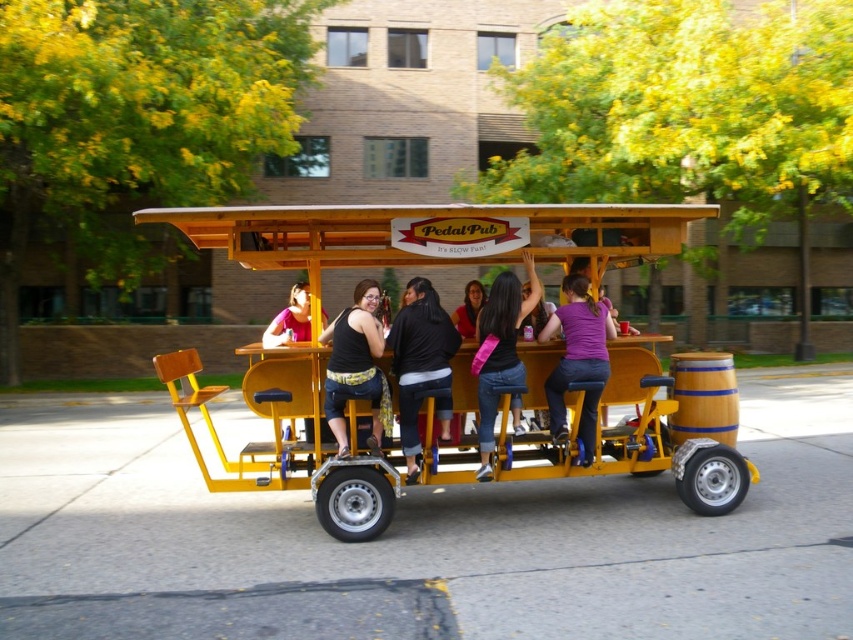
Which is above, yellow wood pedal pub at center or matte black shirt at center?

matte black shirt at center is higher up.

Which of these two, yellow wood pedal pub at center or matte black shirt at center, stands taller?

yellow wood pedal pub at center

Is point (149, 214) less distant than point (483, 464)?

Yes, it is.

Where is `yellow wood pedal pub at center`? This screenshot has height=640, width=853. yellow wood pedal pub at center is located at coordinates (430, 257).

Is point (718, 456) in front of point (424, 300)?

No, it is behind (424, 300).

Does yellow wood pedal pub at center appear over black matte pants at center?

Yes.

Is point (608, 236) positioned behind point (407, 476)?

Yes, point (608, 236) is behind point (407, 476).

The height and width of the screenshot is (640, 853). I want to click on yellow wood pedal pub at center, so click(430, 257).

Can you confirm if black matte pants at center is positioned below matte black shirt at center?

Yes.

Can you confirm if black matte pants at center is wider than matte black shirt at center?

In fact, black matte pants at center might be narrower than matte black shirt at center.

I want to click on black matte pants at center, so click(x=421, y=364).